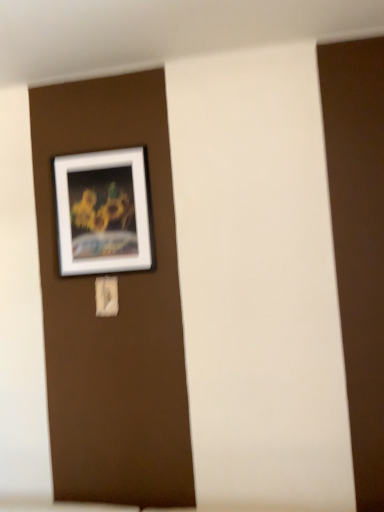
What do you see at coordinates (103, 212) in the screenshot? I see `white matte picture frame at upper center` at bounding box center [103, 212].

In order to face white matte picture frame at upper center, should I rotate leftwards or rightwards?

It's best to rotate left around 12.118 degrees.

What is the approximate width of white matte picture frame at upper center?

white matte picture frame at upper center is 3.87 centimeters wide.

Image resolution: width=384 pixels, height=512 pixels. What are the coordinates of `white matte picture frame at upper center` in the screenshot? It's located at (103, 212).

The image size is (384, 512). I want to click on white matte picture frame at upper center, so click(103, 212).